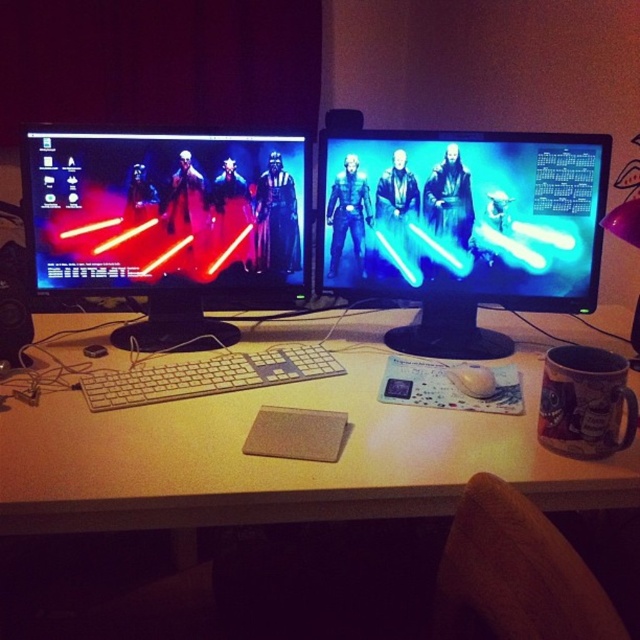
Does point (196, 445) come in front of point (300, 369)?

Yes, it is.

Between white matte computer desk at center and white plastic keyboard at center, which one has less height?

white plastic keyboard at center

Who is more forward, (60, 488) or (154, 396)?

Point (60, 488)

Locate an element on the screen. This screenshot has height=640, width=640. white matte computer desk at center is located at coordinates (284, 458).

Can you confirm if blue glossy lightsaber at center is shorter than white matte mouse at center?

Incorrect, blue glossy lightsaber at center's height does not fall short of white matte mouse at center's.

From the picture: Can you confirm if blue glossy lightsaber at center is positioned above white matte mouse at center?

Indeed, blue glossy lightsaber at center is positioned over white matte mouse at center.

Find the location of `blue glossy lightsaber at center`. blue glossy lightsaber at center is located at coordinates (464, 216).

Identify the location of blue glossy lightsaber at center. (464, 216).

Does white plastic keyboard at center have a lesser height compared to white matte mouse at center?

No.

Is point (202, 387) more distant than point (472, 396)?

Yes, point (202, 387) is behind point (472, 396).

Does point (84, 394) come behind point (460, 376)?

No.

Locate an element on the screen. Image resolution: width=640 pixels, height=640 pixels. white plastic keyboard at center is located at coordinates (208, 376).